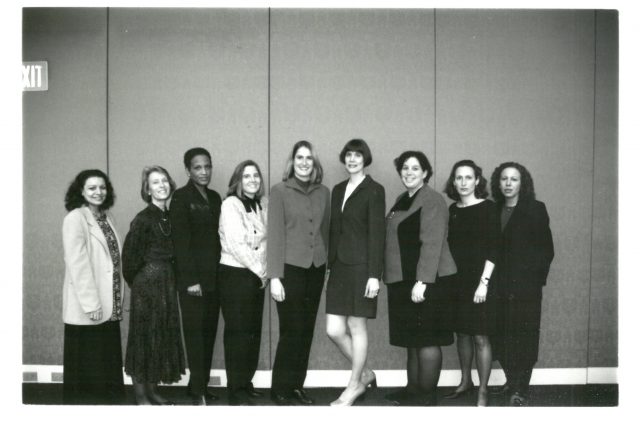
You are a GUI agent. You are given a task and a screenshot of the screen. Output one action in this format:
    pyautogui.click(x=<x>, y=<y>)
    Task: Click on the floor
    
    Given the screenshot: What is the action you would take?
    pyautogui.click(x=573, y=387)